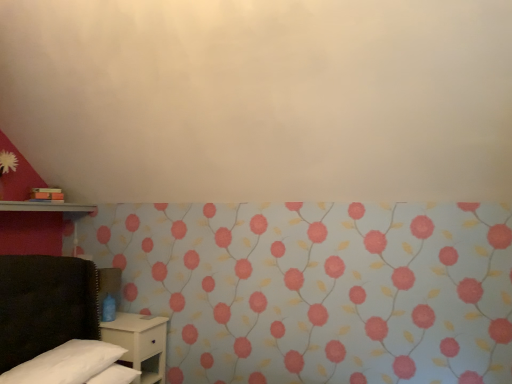
Question: Should I look upward or downward to see metallic silver shelf at left?

Choices:
 (A) up
 (B) down

Answer: (B)

Question: Considering the relative sizes of metallic silver shelf at left and floral wallpaper at lower left in the image provided, is metallic silver shelf at left smaller than floral wallpaper at lower left?

Choices:
 (A) yes
 (B) no

Answer: (A)

Question: Can you confirm if metallic silver shelf at left is taller than floral wallpaper at lower left?

Choices:
 (A) yes
 (B) no

Answer: (B)

Question: Considering the relative positions of metallic silver shelf at left and floral wallpaper at lower left in the image provided, is metallic silver shelf at left to the right of floral wallpaper at lower left from the viewer's perspective?

Choices:
 (A) no
 (B) yes

Answer: (A)

Question: Is metallic silver shelf at left bigger than floral wallpaper at lower left?

Choices:
 (A) no
 (B) yes

Answer: (A)

Question: From the image's perspective, is metallic silver shelf at left on floral wallpaper at lower left?

Choices:
 (A) no
 (B) yes

Answer: (B)

Question: Considering the relative sizes of metallic silver shelf at left and floral wallpaper at lower left in the image provided, is metallic silver shelf at left thinner than floral wallpaper at lower left?

Choices:
 (A) yes
 (B) no

Answer: (A)

Question: Is white matte nightstand at lower left directly adjacent to white soft pillow at lower left?

Choices:
 (A) no
 (B) yes

Answer: (A)

Question: Can you confirm if white matte nightstand at lower left is shorter than white soft pillow at lower left?

Choices:
 (A) yes
 (B) no

Answer: (B)

Question: Is white matte nightstand at lower left not inside white soft pillow at lower left?

Choices:
 (A) no
 (B) yes

Answer: (B)

Question: Is white matte nightstand at lower left at the right side of white soft pillow at lower left?

Choices:
 (A) yes
 (B) no

Answer: (A)

Question: Does white matte nightstand at lower left have a greater height compared to white soft pillow at lower left?

Choices:
 (A) yes
 (B) no

Answer: (A)

Question: Considering the relative sizes of white matte nightstand at lower left and white soft pillow at lower left in the image provided, is white matte nightstand at lower left wider than white soft pillow at lower left?

Choices:
 (A) no
 (B) yes

Answer: (B)

Question: Is metallic silver shelf at left located within white soft pillow at lower left?

Choices:
 (A) yes
 (B) no

Answer: (B)